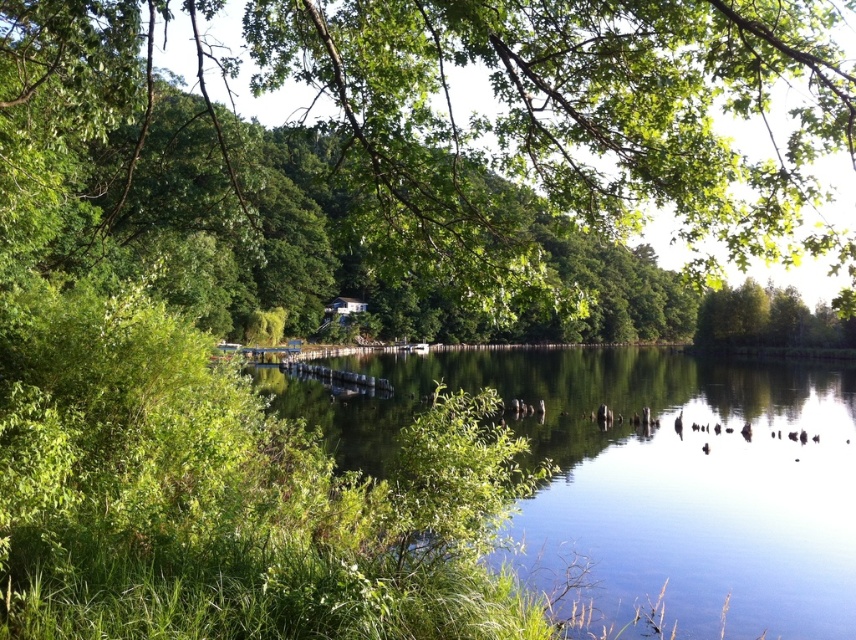
Consider the image. You are standing at the lakeside and want to take a photo of the green leafy tree at upper center and the clear water at center. Which object should you place on the right side of your camera frame to ensure both are captured properly?

You should place the green leafy tree at upper center on the right side of your camera frame since it is already positioned on the right side of the clear water at center, ensuring both are included in the photo.